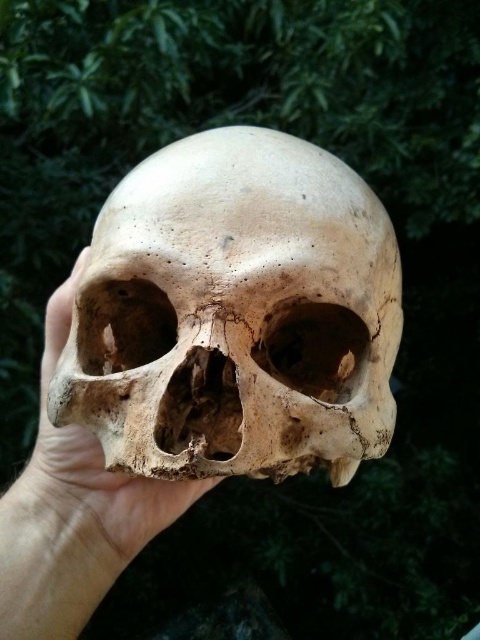
Can you confirm if matte bone skull at center is positioned to the left of smooth beige skull at center?

Incorrect, matte bone skull at center is not on the left side of smooth beige skull at center.

Who is higher up, matte bone skull at center or smooth beige skull at center?

matte bone skull at center

The image size is (480, 640). What do you see at coordinates (236, 314) in the screenshot? I see `matte bone skull at center` at bounding box center [236, 314].

Image resolution: width=480 pixels, height=640 pixels. I want to click on matte bone skull at center, so click(x=236, y=314).